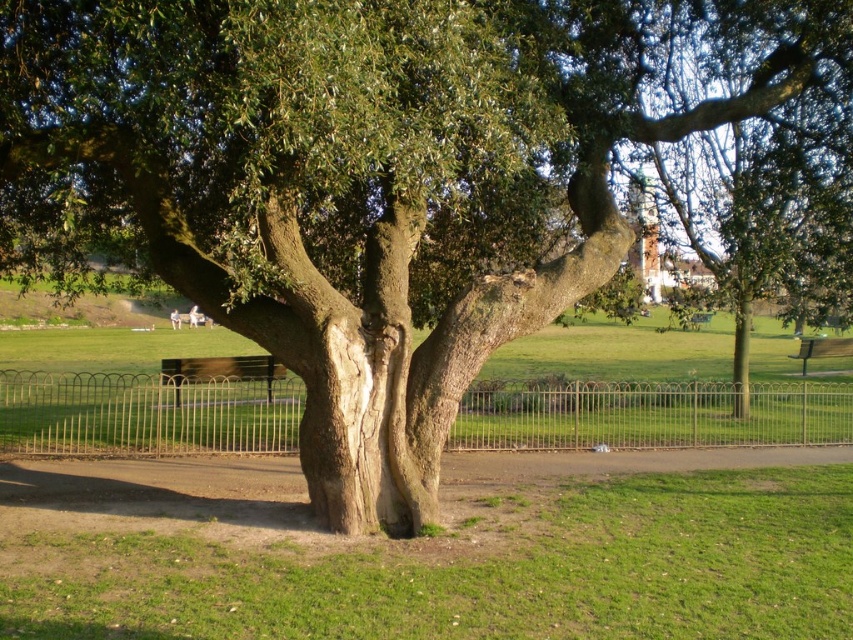
Question: Which object appears closest to the camera in this image?

Choices:
 (A) wooden park bench at lower right
 (B) brown wooden bench at center
 (C) metallic silver fence at center

Answer: (C)

Question: Which point is farther to the camera?

Choices:
 (A) (223, 372)
 (B) (38, 420)
 (C) (825, 349)

Answer: (C)

Question: Is metallic silver fence at center bigger than wooden park bench at lower right?

Choices:
 (A) no
 (B) yes

Answer: (B)

Question: Does metallic silver fence at center appear on the left side of wooden park bench at lower right?

Choices:
 (A) no
 (B) yes

Answer: (B)

Question: Based on their relative distances, which object is farther from the metallic silver fence at center?

Choices:
 (A) wooden park bench at lower right
 (B) brown wooden bench at center

Answer: (A)

Question: Can you confirm if brown wooden bench at center is positioned above wooden park bench at lower right?

Choices:
 (A) yes
 (B) no

Answer: (B)